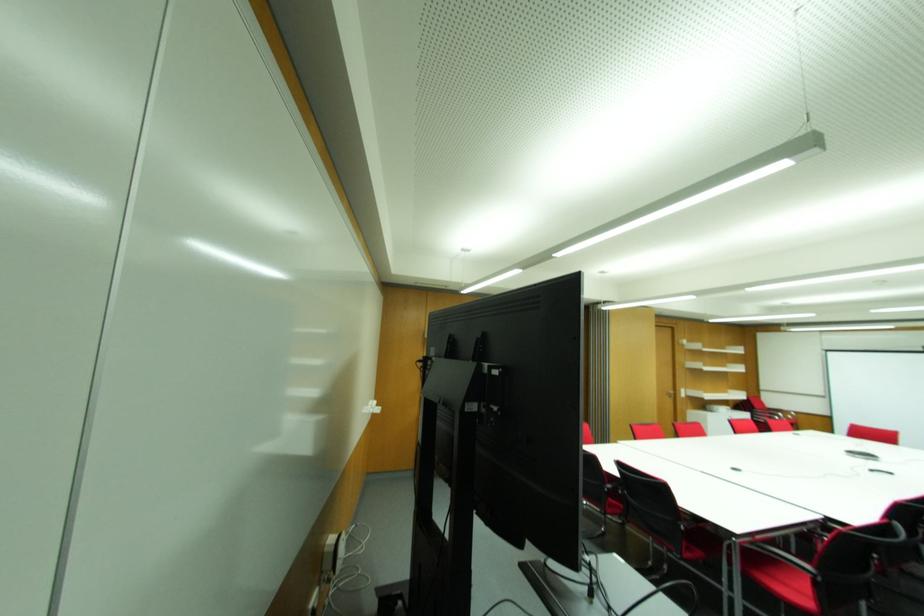
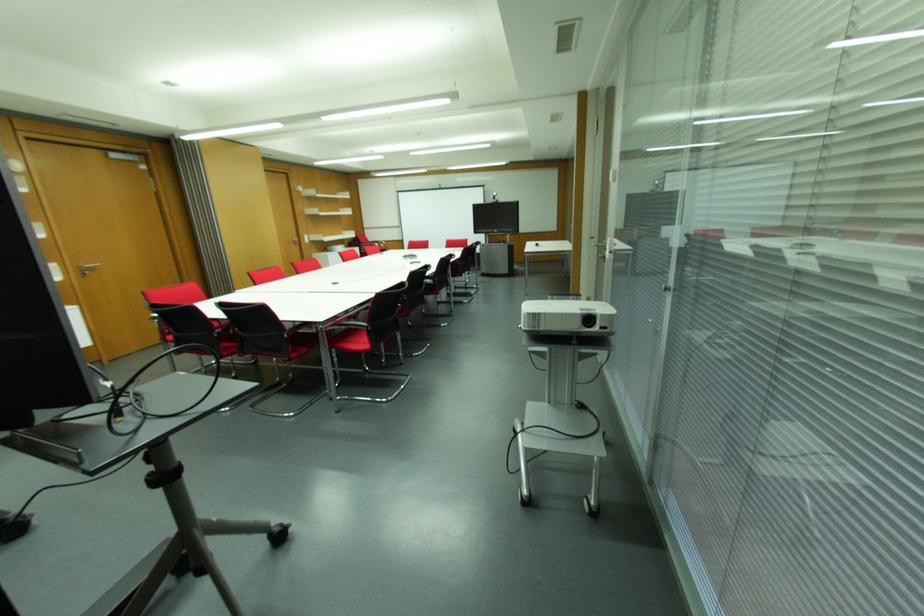
How did the camera likely rotate?

The camera rotated toward right-down.